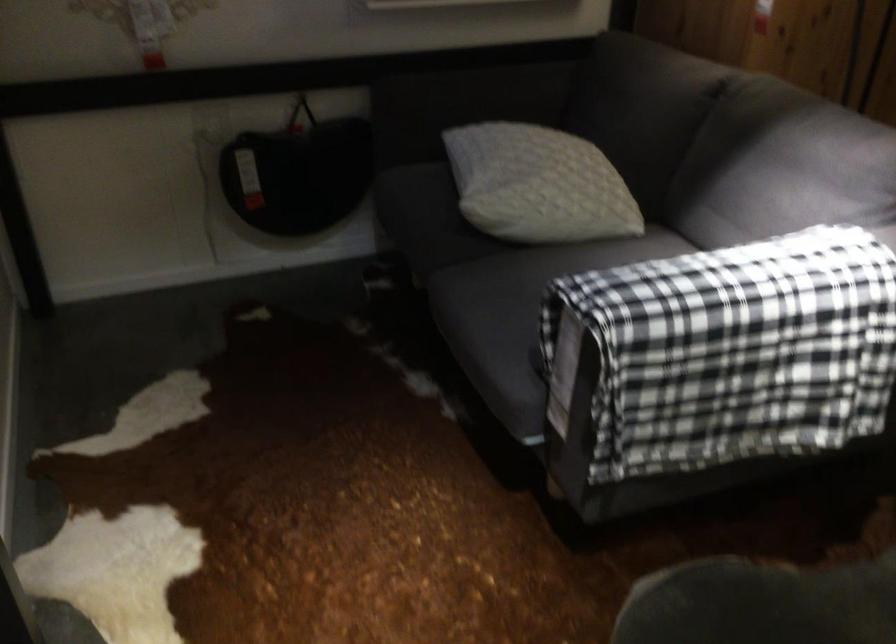
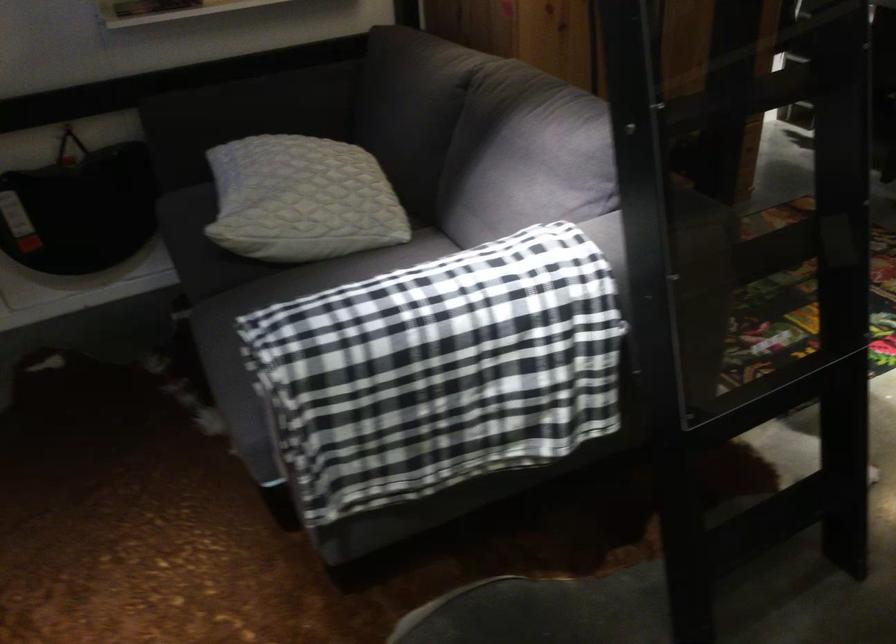
Question: How did the camera likely rotate?

Choices:
 (A) Left
 (B) Right
 (C) Up
 (D) Down

Answer: (B)